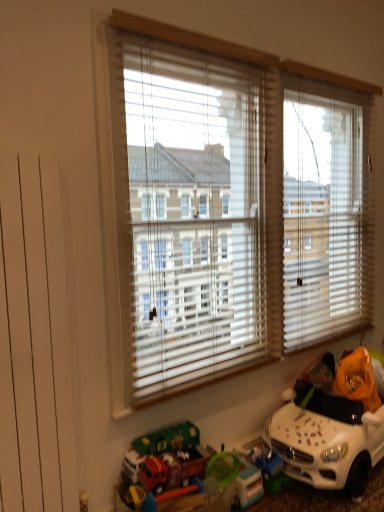
Locate an element on the screen. white blinds at center is located at coordinates pyautogui.click(x=227, y=206).

The height and width of the screenshot is (512, 384). What do you see at coordinates (166, 459) in the screenshot? I see `red plastic fire truck at lower center, the 2th toy when ordered from right to left` at bounding box center [166, 459].

The image size is (384, 512). In order to click on white blinds at center in this screenshot , I will do `click(227, 206)`.

How many degrees apart are the facing directions of white blinds at center and red plastic fire truck at lower center, the first toy positioned from the left?

The angular difference between white blinds at center and red plastic fire truck at lower center, the first toy positioned from the left, is 0.00212 degrees.

From a real-world perspective, is white blinds at center positioned under red plastic fire truck at lower center, the 2th toy when ordered from right to left, based on gravity?

No, from a real-world perspective, white blinds at center is not beneath red plastic fire truck at lower center, the 2th toy when ordered from right to left.

Locate an element on the screen. window above the red plastic fire truck at lower center, the first toy positioned from the left (from the image's perspective) is located at coordinates 227,206.

Could you tell me if white blinds at center is turned towards red plastic fire truck at lower center, the first toy positioned from the left?

No, white blinds at center is not aimed at red plastic fire truck at lower center, the first toy positioned from the left.

Which object is positioned more to the left, red plastic fire truck at lower center, the 2th toy when ordered from right to left, or white blinds at center?

From the viewer's perspective, red plastic fire truck at lower center, the 2th toy when ordered from right to left, appears more on the left side.

Measure the distance between red plastic fire truck at lower center, the 2th toy when ordered from right to left, and white blinds at center.

A distance of 36.78 inches exists between red plastic fire truck at lower center, the 2th toy when ordered from right to left, and white blinds at center.

Is red plastic fire truck at lower center, the first toy positioned from the left, inside the boundaries of white blinds at center, or outside?

red plastic fire truck at lower center, the first toy positioned from the left, is located beyond the bounds of white blinds at center.

In terms of width, does red plastic fire truck at lower center, the 2th toy when ordered from right to left, look wider or thinner when compared to white blinds at center?

red plastic fire truck at lower center, the 2th toy when ordered from right to left, is wider than white blinds at center.

From the image's perspective, is white plastic toy car at lower right, acting as the 2th toy starting from the left, located beneath red plastic fire truck at lower center, the 2th toy when ordered from right to left?

Incorrect, from the image's perspective, white plastic toy car at lower right, acting as the 2th toy starting from the left, is higher than red plastic fire truck at lower center, the 2th toy when ordered from right to left.

Considering the sizes of white plastic toy car at lower right, acting as the 2th toy starting from the left, and red plastic fire truck at lower center, the 2th toy when ordered from right to left, in the image, is white plastic toy car at lower right, acting as the 2th toy starting from the left, taller or shorter than red plastic fire truck at lower center, the 2th toy when ordered from right to left,?

white plastic toy car at lower right, acting as the 2th toy starting from the left, is taller than red plastic fire truck at lower center, the 2th toy when ordered from right to left.

Does white plastic toy car at lower right, the 1th toy in the right-to-left sequence, appear on the right side of red plastic fire truck at lower center, the 2th toy when ordered from right to left?

Indeed, white plastic toy car at lower right, the 1th toy in the right-to-left sequence, is positioned on the right side of red plastic fire truck at lower center, the 2th toy when ordered from right to left.

What's the angular difference between white plastic toy car at lower right, the 1th toy in the right-to-left sequence, and red plastic fire truck at lower center, the 2th toy when ordered from right to left,'s facing directions?

0.000919 degrees.

Are white blinds at center and white plastic toy car at lower right, acting as the 2th toy starting from the left, beside each other?

No, white blinds at center is not beside white plastic toy car at lower right, acting as the 2th toy starting from the left.

From the image's perspective, who appears lower, white blinds at center or white plastic toy car at lower right, acting as the 2th toy starting from the left?

white plastic toy car at lower right, acting as the 2th toy starting from the left, from the image's perspective.

Does white blinds at center have a greater width compared to white plastic toy car at lower right, acting as the 2th toy starting from the left?

No.

Which object is further away from the camera taking this photo, red plastic fire truck at lower center, the first toy positioned from the left, or white plastic toy car at lower right, acting as the 2th toy starting from the left?

white plastic toy car at lower right, acting as the 2th toy starting from the left.

Which is more to the left, red plastic fire truck at lower center, the 2th toy when ordered from right to left, or white plastic toy car at lower right, acting as the 2th toy starting from the left?

From the viewer's perspective, red plastic fire truck at lower center, the 2th toy when ordered from right to left, appears more on the left side.

Is red plastic fire truck at lower center, the 2th toy when ordered from right to left, far from white plastic toy car at lower right, acting as the 2th toy starting from the left?

No, red plastic fire truck at lower center, the 2th toy when ordered from right to left, is not far from white plastic toy car at lower right, acting as the 2th toy starting from the left.

Is point (310, 456) closer to viewer compared to point (281, 186)?

Yes.

Considering the sizes of objects white plastic toy car at lower right, acting as the 2th toy starting from the left, and white blinds at center in the image provided, who is wider, white plastic toy car at lower right, acting as the 2th toy starting from the left, or white blinds at center?

Wider between the two is white plastic toy car at lower right, acting as the 2th toy starting from the left.

You are a GUI agent. You are given a task and a screenshot of the screen. Output one action in this format:
    pyautogui.click(x=<x>, y=<y>)
    Task: Click on the window that is above the red plastic fire truck at lower center, the 2th toy when ordered from right to left (from the image's perspective)
    This screenshot has width=384, height=512.
    Given the screenshot: What is the action you would take?
    pyautogui.click(x=227, y=206)

Identify the location of toy in front of the white blinds at center. The width and height of the screenshot is (384, 512). (166, 459).

Looking at the image, which one is located further to white plastic toy car at lower right, acting as the 2th toy starting from the left, red plastic fire truck at lower center, the first toy positioned from the left, or white blinds at center?

white blinds at center lies further to white plastic toy car at lower right, acting as the 2th toy starting from the left, than the other object.

Which object lies further to the anchor point red plastic fire truck at lower center, the 2th toy when ordered from right to left, white blinds at center or white plastic toy car at lower right, acting as the 2th toy starting from the left?

Based on the image, white blinds at center appears to be further to red plastic fire truck at lower center, the 2th toy when ordered from right to left.

Which object lies nearer to the anchor point white plastic toy car at lower right, acting as the 2th toy starting from the left, white blinds at center or red plastic fire truck at lower center, the 2th toy when ordered from right to left?

red plastic fire truck at lower center, the 2th toy when ordered from right to left.

Based on their spatial positions, is white plastic toy car at lower right, the 1th toy in the right-to-left sequence, or white blinds at center closer to red plastic fire truck at lower center, the first toy positioned from the left?

white plastic toy car at lower right, the 1th toy in the right-to-left sequence, lies closer to red plastic fire truck at lower center, the first toy positioned from the left, than the other object.

Based on their spatial positions, is red plastic fire truck at lower center, the 2th toy when ordered from right to left, or white plastic toy car at lower right, the 1th toy in the right-to-left sequence, closer to white blinds at center?

white plastic toy car at lower right, the 1th toy in the right-to-left sequence, lies closer to white blinds at center than the other object.

Considering their positions, is white plastic toy car at lower right, the 1th toy in the right-to-left sequence, positioned closer to white blinds at center than red plastic fire truck at lower center, the first toy positioned from the left?

white plastic toy car at lower right, the 1th toy in the right-to-left sequence, is closer to white blinds at center.

Where is `toy between white blinds at center and red plastic fire truck at lower center, the first toy positioned from the left, vertically`? The image size is (384, 512). toy between white blinds at center and red plastic fire truck at lower center, the first toy positioned from the left, vertically is located at coordinates (326, 440).